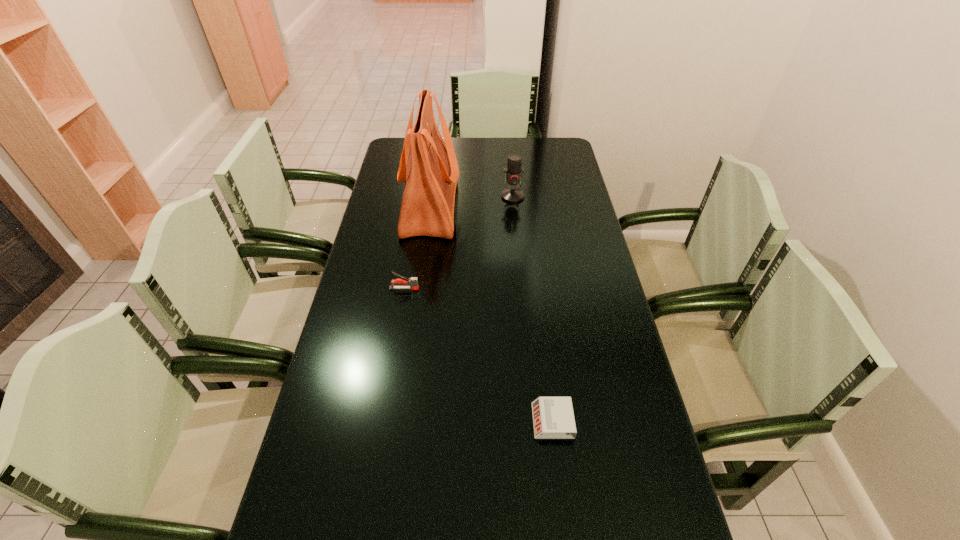
At what (x,y) coordinates should I click in order to perform the action: click on vacant point located between the third farthest object and the microphone. Please return your answer as a coordinate pair (x, y). The height and width of the screenshot is (540, 960). Looking at the image, I should click on (459, 242).

Find the location of a particular element. The image size is (960, 540). free spot between the third farthest object and the nearest object is located at coordinates (478, 355).

Locate an element on the screen. Image resolution: width=960 pixels, height=540 pixels. free space between the alarm clock and the stapler is located at coordinates (478, 355).

Locate an element on the screen. Image resolution: width=960 pixels, height=540 pixels. free spot between the second tallest object and the tallest object is located at coordinates (471, 201).

Identify the location of unoccupied position between the tallest object and the third tallest object. Image resolution: width=960 pixels, height=540 pixels. (418, 248).

At what (x,y) coordinates should I click in order to perform the action: click on the closest object to the second shortest object. Please return your answer as a coordinate pair (x, y). The width and height of the screenshot is (960, 540). Looking at the image, I should click on (430, 174).

Where is `object that stands as the closest to the second tallest object`? The height and width of the screenshot is (540, 960). object that stands as the closest to the second tallest object is located at coordinates (430, 174).

Locate an element on the screen. The image size is (960, 540). vacant area in the image that satisfies the following two spatial constraints: 1. on the side of the nearest object with the red ring; 2. on the right side of the third shortest object is located at coordinates (533, 421).

Identify the location of vacant space that satisfies the following two spatial constraints: 1. on the front pocket of the shopping bag; 2. on the back side of the shortest object. (401, 421).

The height and width of the screenshot is (540, 960). I want to click on vacant space that satisfies the following two spatial constraints: 1. on the front pocket of the alarm clock; 2. on the right side of the shopping bag, so click(401, 421).